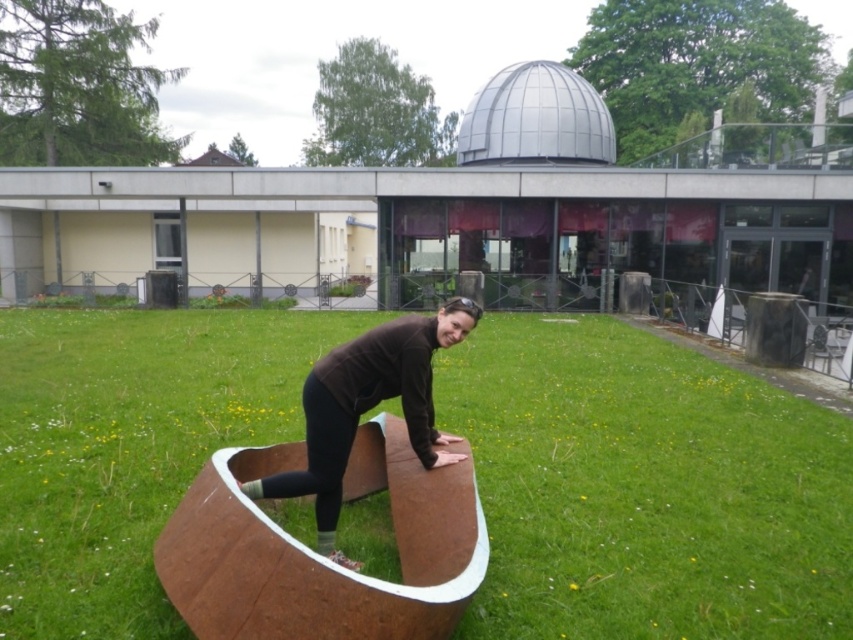
Is green grass at center closer to the viewer compared to brown matte bench at center?

Yes, green grass at center is closer to the viewer.

Does green grass at center appear over brown matte bench at center?

Indeed, green grass at center is positioned over brown matte bench at center.

Is point (233, 317) closer to camera compared to point (444, 328)?

That is False.

Find the location of a particular element. The height and width of the screenshot is (640, 853). green grass at center is located at coordinates coord(645,490).